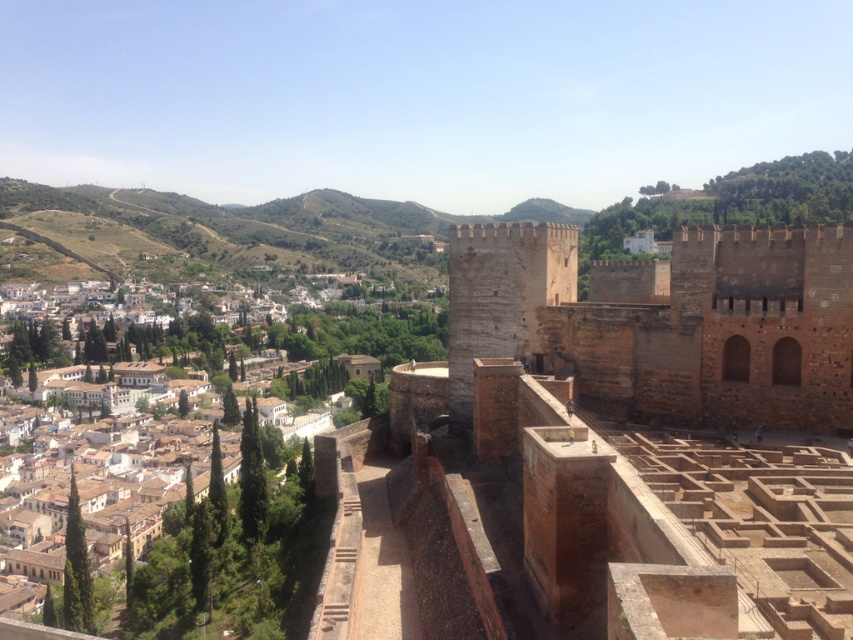
Can you confirm if brown stone fort at center is positioned below brown stone town at center?

Incorrect, brown stone fort at center is not positioned below brown stone town at center.

Can you confirm if brown stone fort at center is smaller than brown stone town at center?

Indeed, brown stone fort at center has a smaller size compared to brown stone town at center.

Who is more distant from viewer, (624, 552) or (187, 544)?

The point (187, 544) is behind.

What are the coordinates of `brown stone fort at center` in the screenshot? It's located at [x=606, y=448].